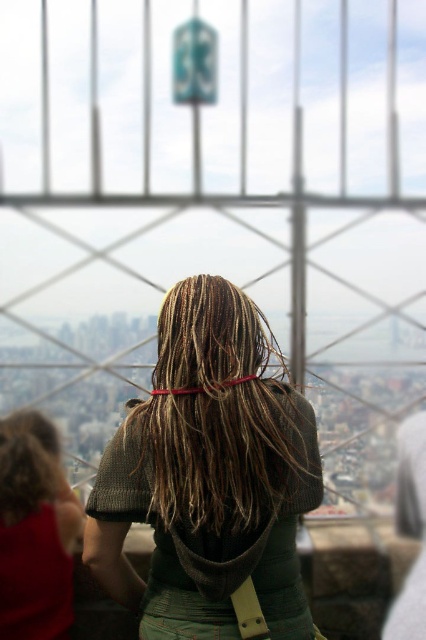
Which is more to the left, matte green shirt at lower left or curly brown hair at lower left?

curly brown hair at lower left is more to the left.

Looking at this image, which is below, matte green shirt at lower left or curly brown hair at lower left?

matte green shirt at lower left

Identify the location of matte green shirt at lower left. (34, 531).

Does brown/dry hair at center come behind curly brown hair at lower left?

No, it is in front of curly brown hair at lower left.

Which of these two, brown/dry hair at center or curly brown hair at lower left, stands shorter?

Standing shorter between the two is curly brown hair at lower left.

Does point (189, 304) lie in front of point (16, 483)?

Yes, point (189, 304) is in front of point (16, 483).

I want to click on brown/dry hair at center, so (218, 412).

Who is more forward, (245, 468) or (57, 531)?

Point (245, 468)

Which is above, brown/dry hair at center or matte green shirt at lower left?

brown/dry hair at center is above.

Which is in front, point (189, 483) or point (72, 506)?

Point (189, 483) is more forward.

Where is `brown/dry hair at center`? Image resolution: width=426 pixels, height=640 pixels. brown/dry hair at center is located at coordinates (218, 412).